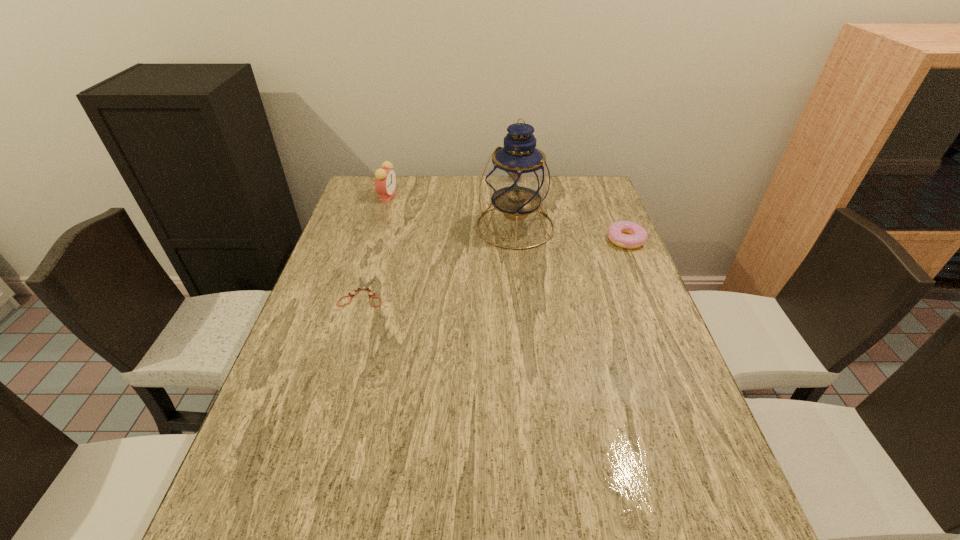
The image size is (960, 540). I want to click on object that is at the right edge, so pos(617,232).

I want to click on object present at the far left corner, so click(x=385, y=178).

In the image, there is a desktop. Identify the location of vacant space at the far edge. (461, 183).

In the image, there is a desktop. Identify the location of free space at the near edge. (418, 496).

Find the location of a particular element. vacant space at the right edge is located at coordinates (663, 340).

Locate an element on the screen. This screenshot has width=960, height=540. free space at the far left corner of the desktop is located at coordinates (402, 182).

You are a GUI agent. You are given a task and a screenshot of the screen. Output one action in this format:
    pyautogui.click(x=<x>, y=<y>)
    Task: Click on the vacant space at the near left corner of the desktop
    The height and width of the screenshot is (540, 960).
    Given the screenshot: What is the action you would take?
    [258, 482]

Where is `vacant space at the far right corner of the desktop`? This screenshot has height=540, width=960. vacant space at the far right corner of the desktop is located at coordinates (600, 185).

At what (x,y) coordinates should I click in order to perform the action: click on free location at the near right corner. Please return your answer as a coordinate pair (x, y). Image resolution: width=960 pixels, height=540 pixels. Looking at the image, I should click on (712, 464).

Locate an element on the screen. The height and width of the screenshot is (540, 960). vacant point located between the alarm clock and the shortest object is located at coordinates (375, 244).